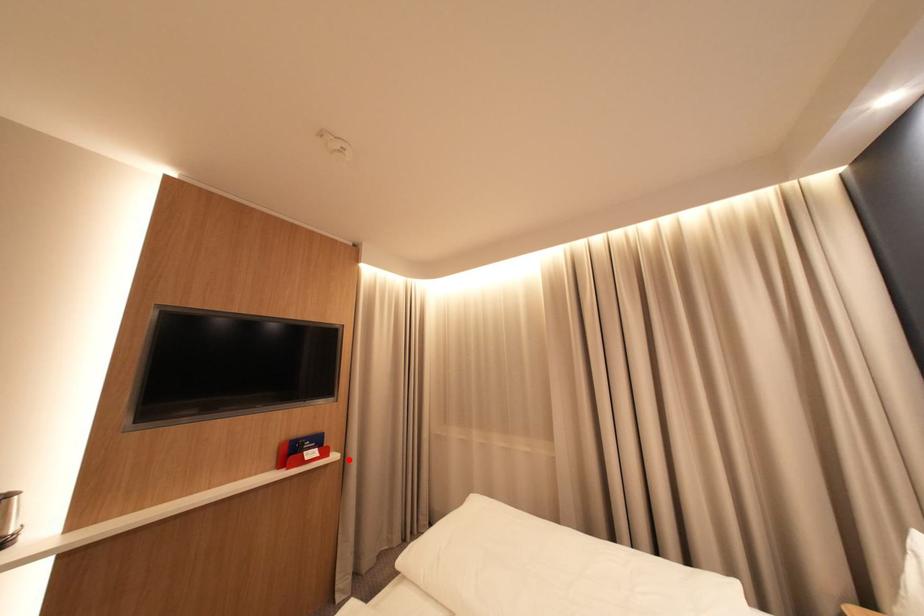
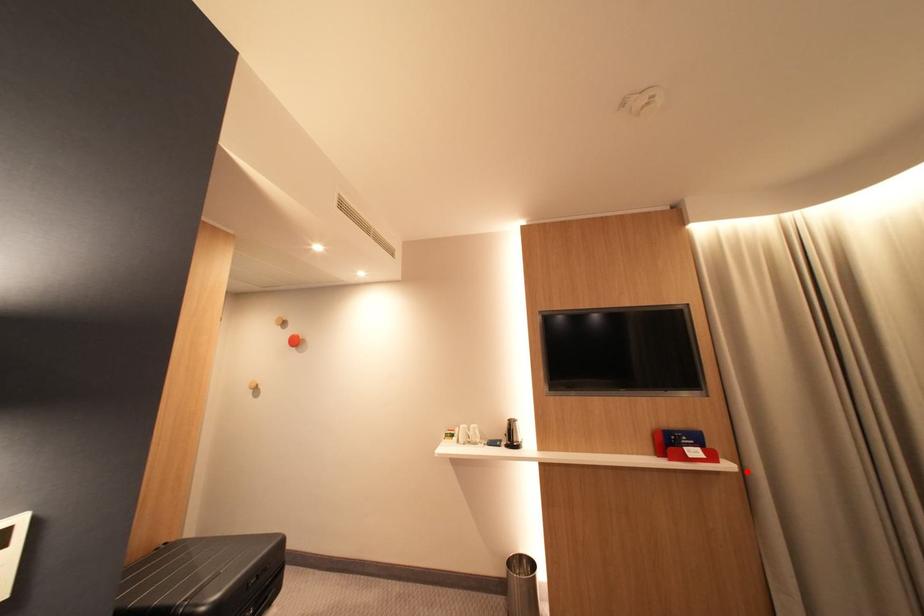
I am providing you with two images of the same scene from different viewpoints. A red point is marked on the first image and another point is marked on the second image. Do the highlighted points in image1 and image2 indicate the same real-world spot?

Yes